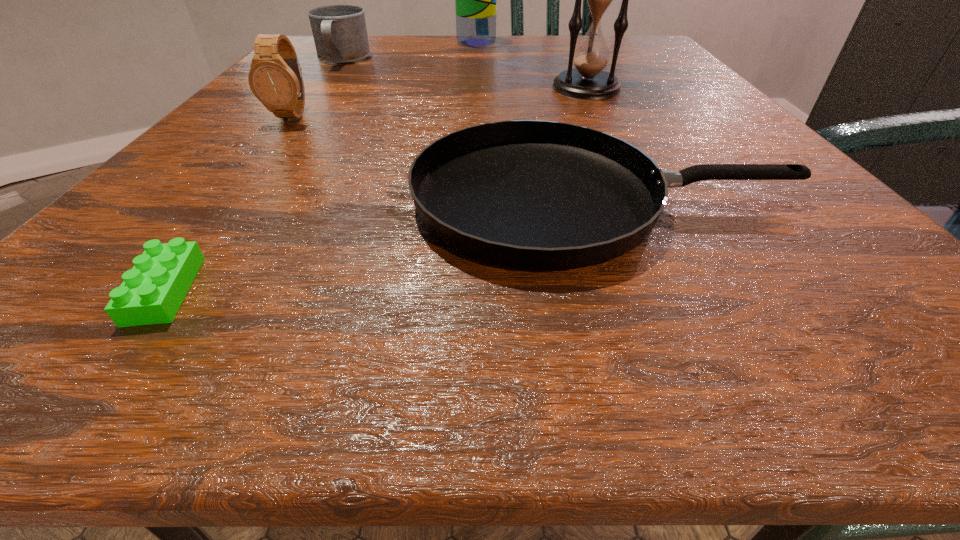
At what (x,y) coordinates should I click in order to perform the action: click on frying pan that is at the right edge. Please return your answer as a coordinate pair (x, y). This screenshot has width=960, height=540. Looking at the image, I should click on (536, 195).

Identify the location of object at the far left corner. (339, 31).

Where is `object at the near left corner`? The height and width of the screenshot is (540, 960). object at the near left corner is located at coordinates (152, 292).

This screenshot has height=540, width=960. I want to click on blank space at the far edge, so click(x=398, y=43).

In the image, there is a desktop. Identify the location of vacant space at the near edge. (694, 281).

The image size is (960, 540). I want to click on vacant area at the left edge of the desktop, so click(x=302, y=70).

Find the location of a particular element. vacant space at the right edge of the desktop is located at coordinates (718, 153).

In order to click on vacant region at the far right corner of the desktop in this screenshot , I will do `click(630, 45)`.

This screenshot has width=960, height=540. Find the location of `vacant point located between the hourglass and the farthest object`. vacant point located between the hourglass and the farthest object is located at coordinates (531, 65).

At what (x,y) coordinates should I click in order to perform the action: click on free point between the watch and the shortest object. Please return your answer as a coordinate pair (x, y). This screenshot has width=960, height=540. Looking at the image, I should click on (229, 202).